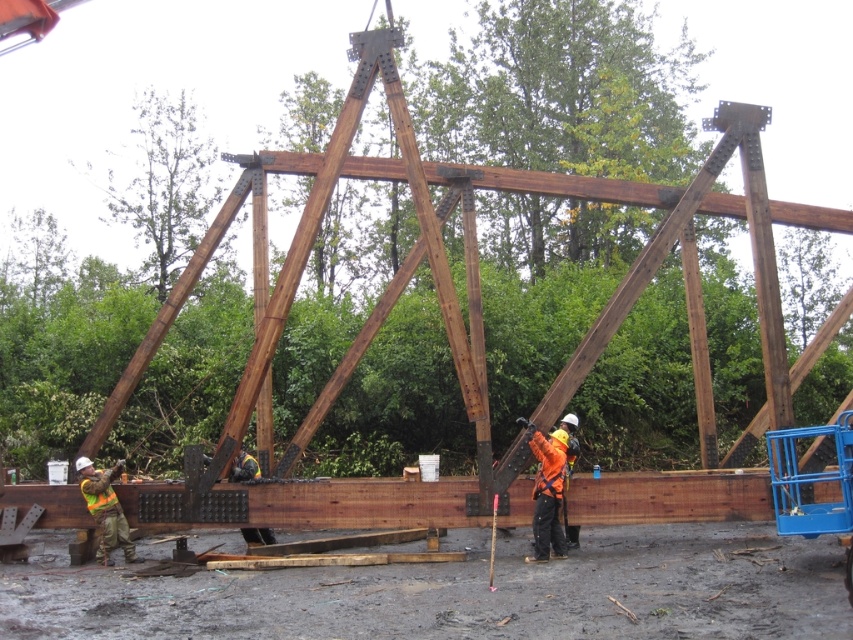
Who is shorter, orange reflective vest at center or reflective yellow safety vest at lower left?

Standing shorter between the two is reflective yellow safety vest at lower left.

Describe the element at coordinates (549, 486) in the screenshot. I see `orange reflective vest at center` at that location.

The image size is (853, 640). Find the location of `orange reflective vest at center`. orange reflective vest at center is located at coordinates (549, 486).

From the picture: Which of these two, reflective orange safety vest at lower left or reflective yellow safety vest at lower left, stands taller?

Standing taller between the two is reflective orange safety vest at lower left.

Which is behind, point (102, 483) or point (96, 508)?

Positioned behind is point (96, 508).

Identify the location of reflective orange safety vest at lower left. This screenshot has height=640, width=853. (105, 509).

Is orange reflective vest at center to the left of reflective orange safety vest at lower left from the viewer's perspective?

No, orange reflective vest at center is not to the left of reflective orange safety vest at lower left.

Which is in front, point (532, 490) or point (131, 554)?

Point (532, 490) is in front.

Who is more distant from viewer, (540, 433) or (96, 552)?

The point (96, 552) is more distant.

At what (x,y) coordinates should I click in order to perform the action: click on orange reflective vest at center. Please return your answer as a coordinate pair (x, y). Looking at the image, I should click on (549, 486).